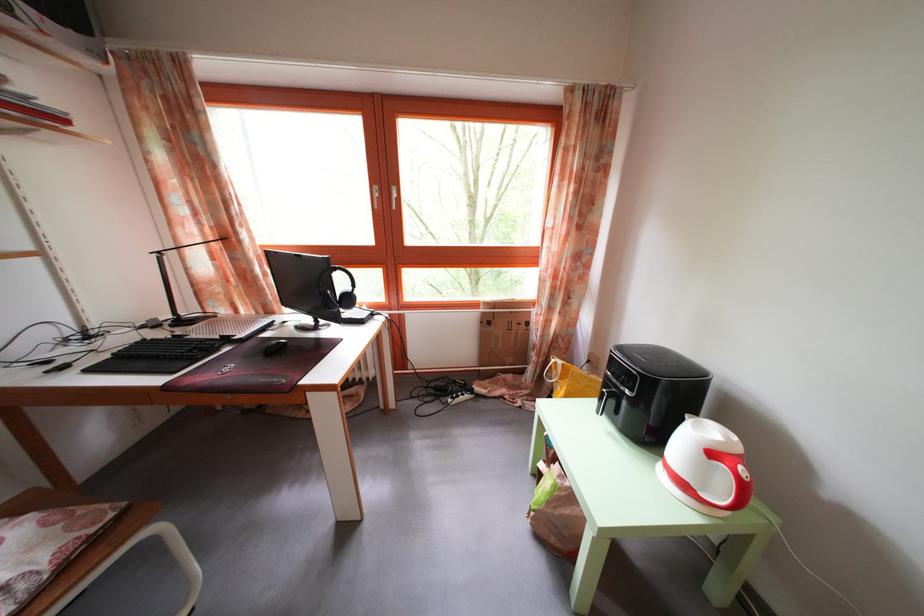
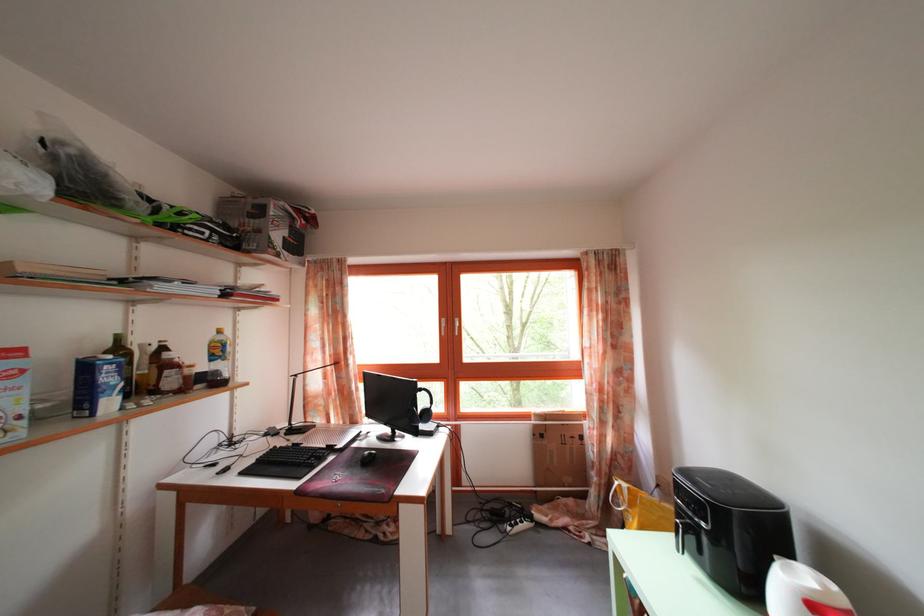
In the second image, find the point that corresponds to point (727, 446) in the first image.

(822, 593)